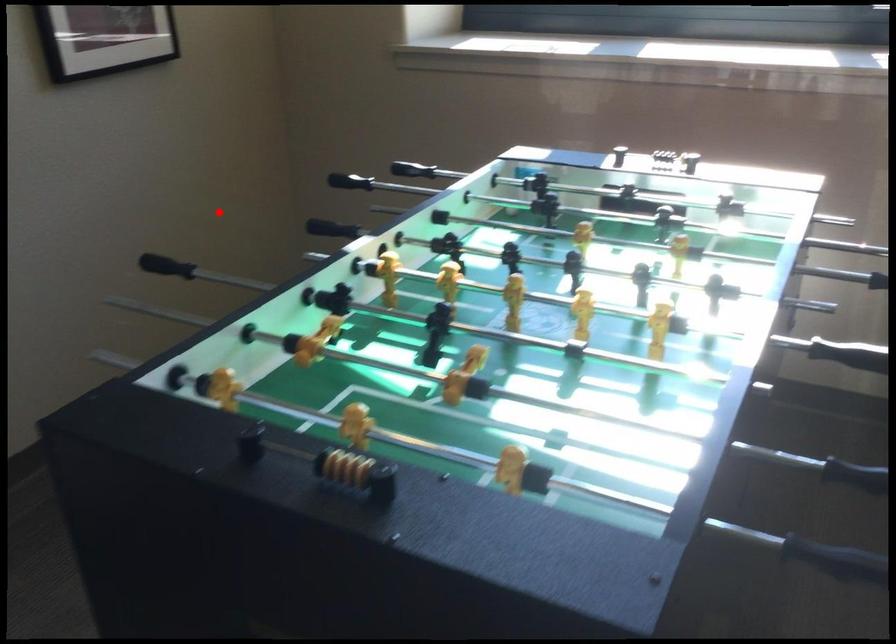
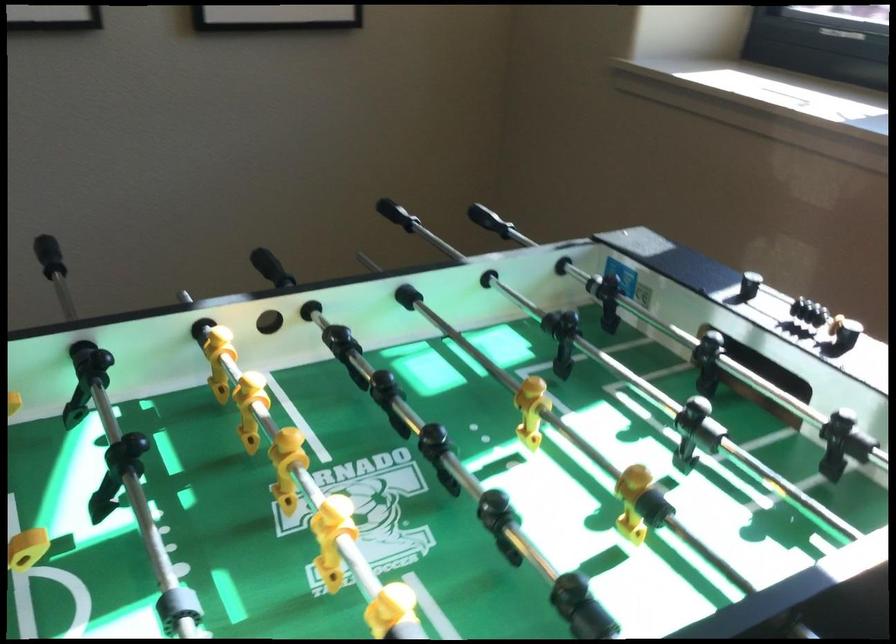
Question: I am providing you with two images of the same scene from different viewpoints. In image1, a red point is highlighted. Considering the same 3D point in image2, which of the following is correct?

Choices:
 (A) It is closer
 (B) It is farther

Answer: (A)